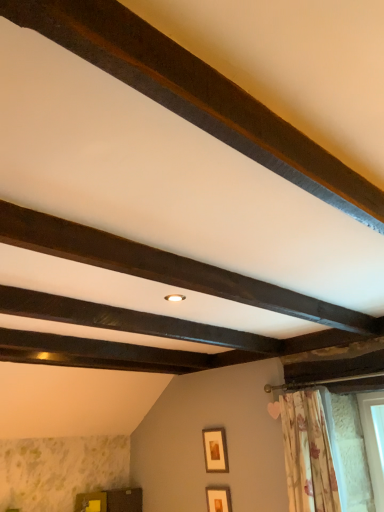
Question: From a real-world perspective, relative to floral fabric curtain at lower right, is dark wood beam at center, the 1th plank in the bottom-to-top sequence, vertically above or below?

Choices:
 (A) above
 (B) below

Answer: (A)

Question: Is dark wood beam at center, the second plank viewed from the top, in front of or behind floral fabric curtain at lower right in the image?

Choices:
 (A) behind
 (B) front

Answer: (B)

Question: Estimate the real-world distances between objects in this image. Which object is closer to the wooden picture frame at center, the first picture frame when ordered from top to bottom?

Choices:
 (A) floral fabric curtain at lower right
 (B) dark brown wood at upper center, the 1th plank from the top
 (C) matte gold picture frame at lower center, which is the first picture frame in bottom-to-top order
 (D) wooden cabinet at lower left
 (E) dark wood beam at center, the second plank viewed from the top

Answer: (C)

Question: Estimate the real-world distances between objects in this image. Which object is farther from the dark brown wood at upper center, the 1th plank from the top?

Choices:
 (A) wooden cabinet at lower left
 (B) wooden picture frame at center, the first picture frame when ordered from top to bottom
 (C) matte gold picture frame at lower center, which is the first picture frame in bottom-to-top order
 (D) floral fabric curtain at lower right
 (E) dark wood beam at center, the 1th plank in the bottom-to-top sequence

Answer: (A)